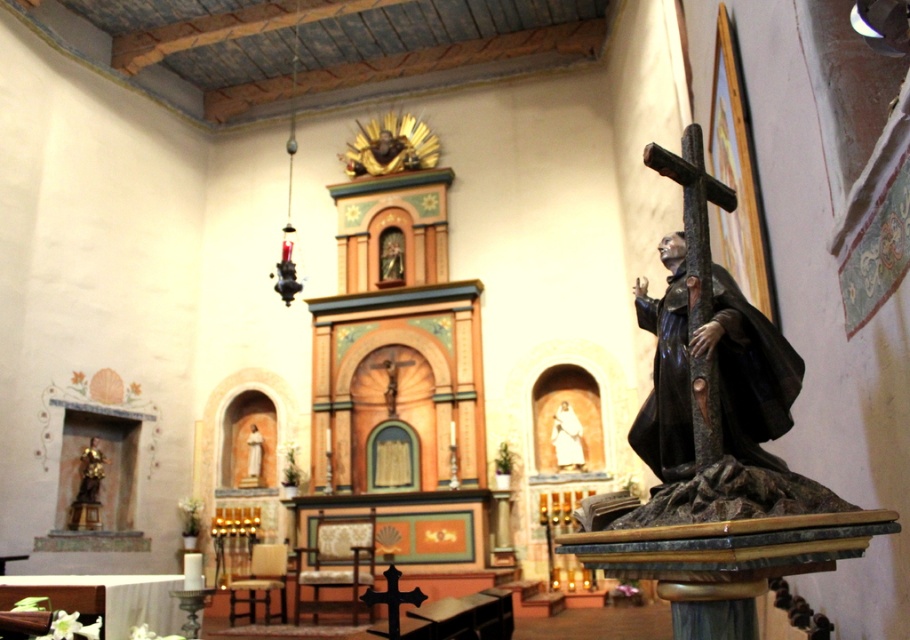
Question: Can you confirm if polished dark wood statue at right is positioned to the left of gold statue at left?

Choices:
 (A) yes
 (B) no

Answer: (B)

Question: Where is polished dark wood statue at right located in relation to smooth white statue at center in the image?

Choices:
 (A) below
 (B) above

Answer: (B)

Question: Is polished dark wood statue at right to the right of gold leaf statue at upper center from the viewer's perspective?

Choices:
 (A) no
 (B) yes

Answer: (B)

Question: Among these points, which one is nearest to the camera?

Choices:
 (A) (79, 452)
 (B) (373, 172)
 (C) (579, 436)
 (D) (250, 445)

Answer: (A)

Question: Which object is the closest to the smooth white statue at center?

Choices:
 (A) white cloth figure at center
 (B) gold statue at left
 (C) gold leaf statue at upper center

Answer: (B)

Question: Which point appears farthest from the camera in this image?

Choices:
 (A) (251, 460)
 (B) (385, 170)

Answer: (B)